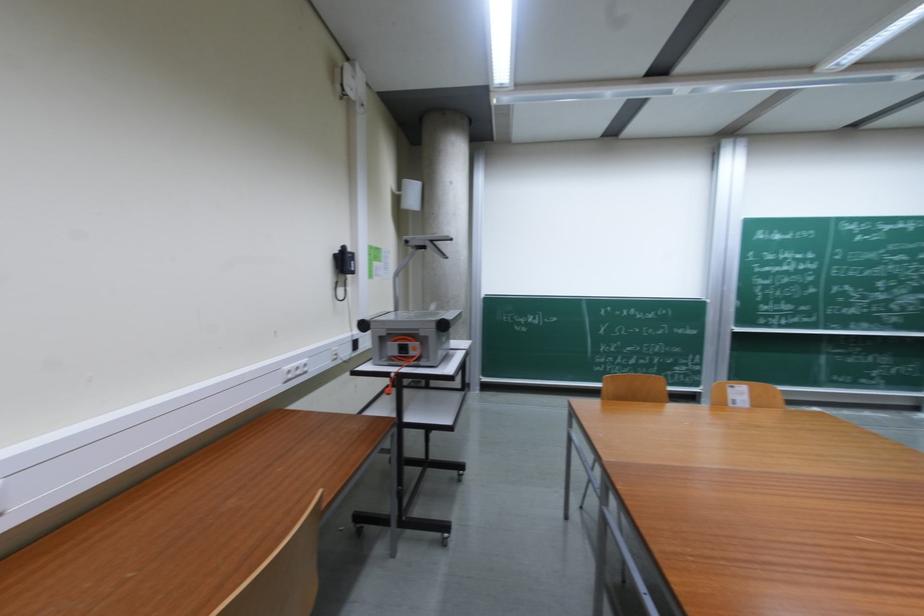
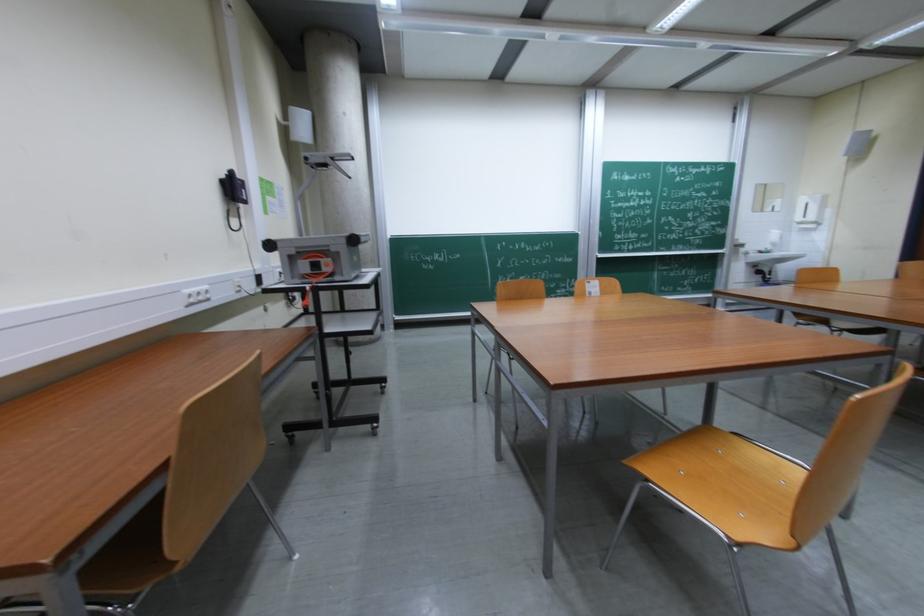
Question: Which direction would the cameraman need to move to produce the second image? Reply with the corresponding letter.

Choices:
 (A) Left
 (B) Right
 (C) Forward
 (D) Backward

Answer: (D)